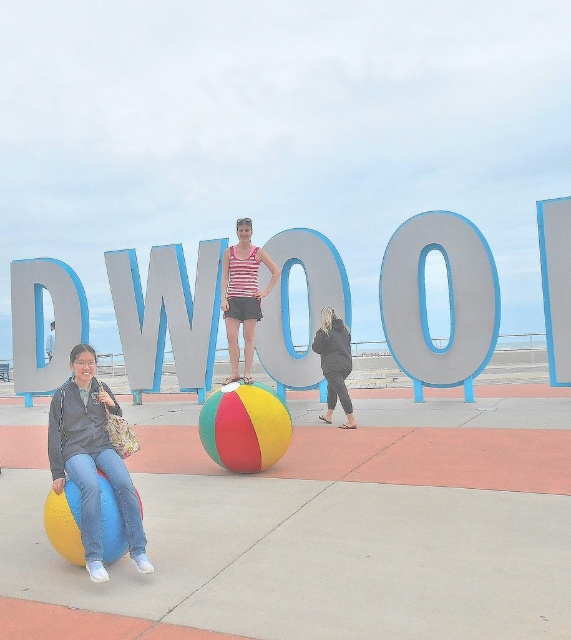
Please answer based on the provided scene description. Is the point at coordinates (136, 321) located on the red platform or on the DWOOD sign?

The point at coordinates (136, 321) is located on the matte gray letter W at the center of the DWOOD sign, not on the red platform.

You are a photographer trying to capture a photo of the matte gray letter w at center and the multicolored rubber beach ball at lower left. Which object should you focus on first if you want to ensure both are in frame without moving the camera?

The matte gray letter w at center is taller than the multicolored rubber beach ball at lower left. Therefore, you should focus on the matte gray letter w at center first to ensure it fits within the frame, as its greater height may require adjusting the camera angle or zoom to accommodate both objects.